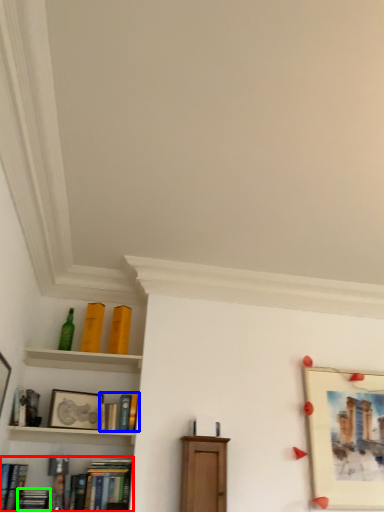
Question: Which is nearer to the book (highlighted by a red box)? book (highlighted by a blue box) or book (highlighted by a green box).

Choices:
 (A) book
 (B) book

Answer: (B)